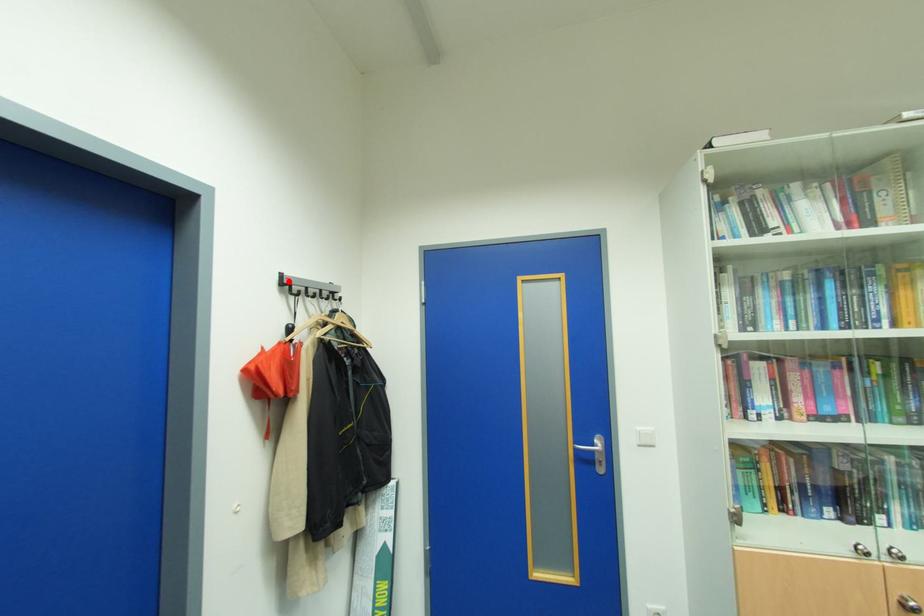
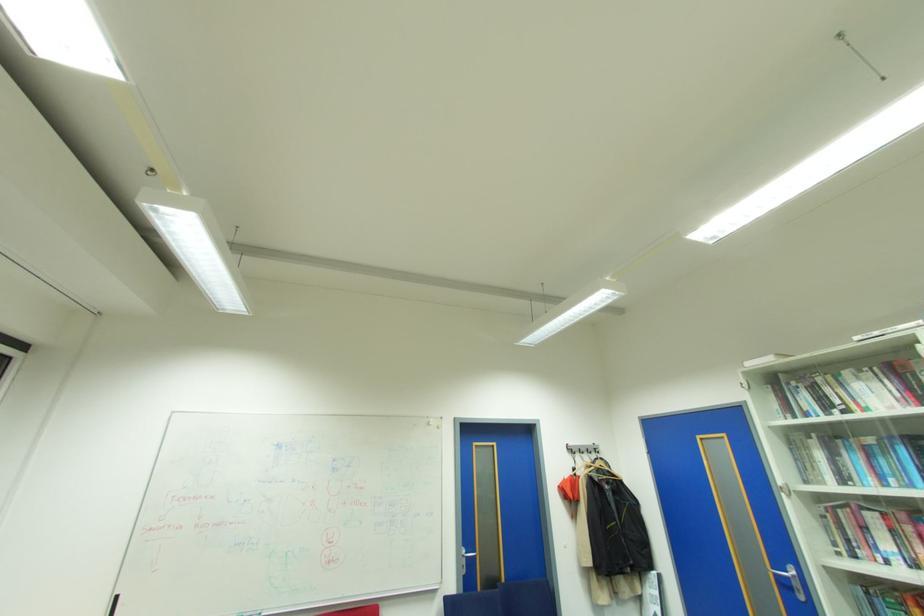
Question: I am providing you with two images of the same scene from different viewpoints. A red point is shown in image1. For the corresponding object point in image2, is it positioned nearer or farther from the camera?

Choices:
 (A) Nearer
 (B) Farther

Answer: (B)